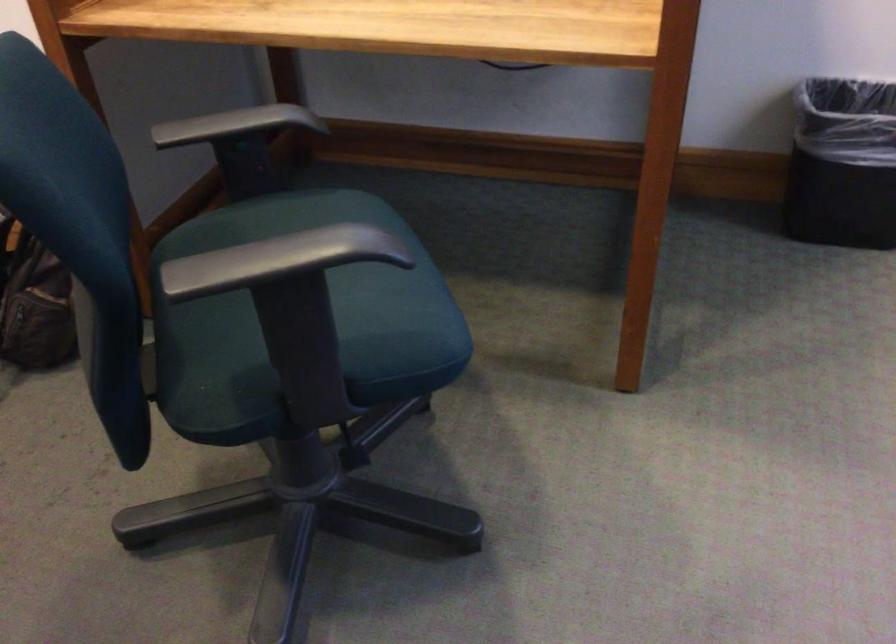
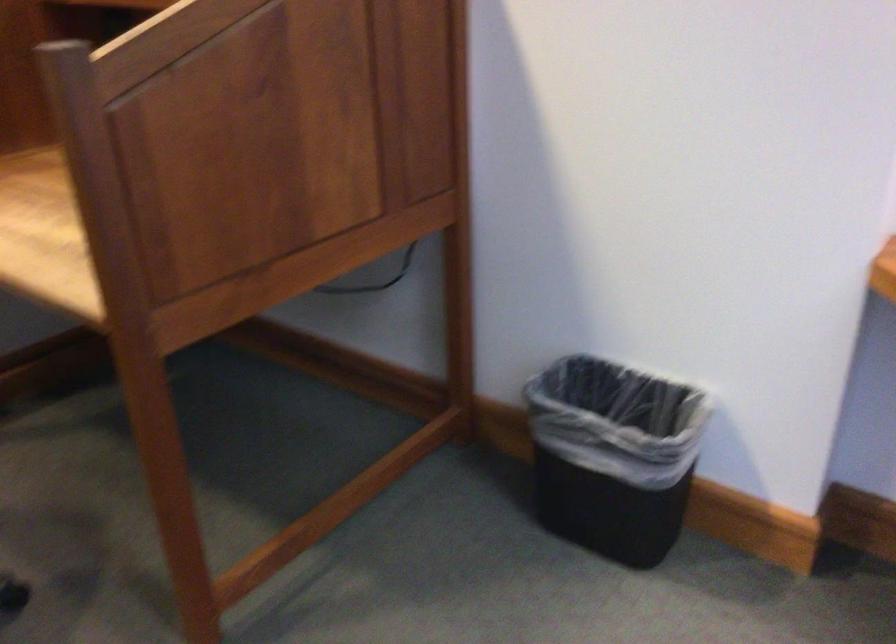
Question: Which direction would the cameraman need to move to produce the second image? Reply with the corresponding letter.

Choices:
 (A) Left
 (B) Right
 (C) Forward
 (D) Backward

Answer: (B)